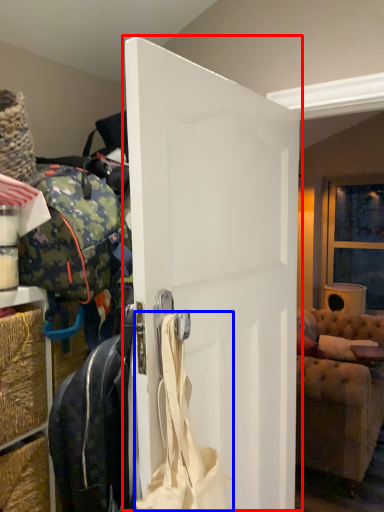
Question: Which point is closer to the camera, door (highlighted by a red box) or shoulder bag (highlighted by a blue box)?

Choices:
 (A) door
 (B) shoulder bag

Answer: (B)